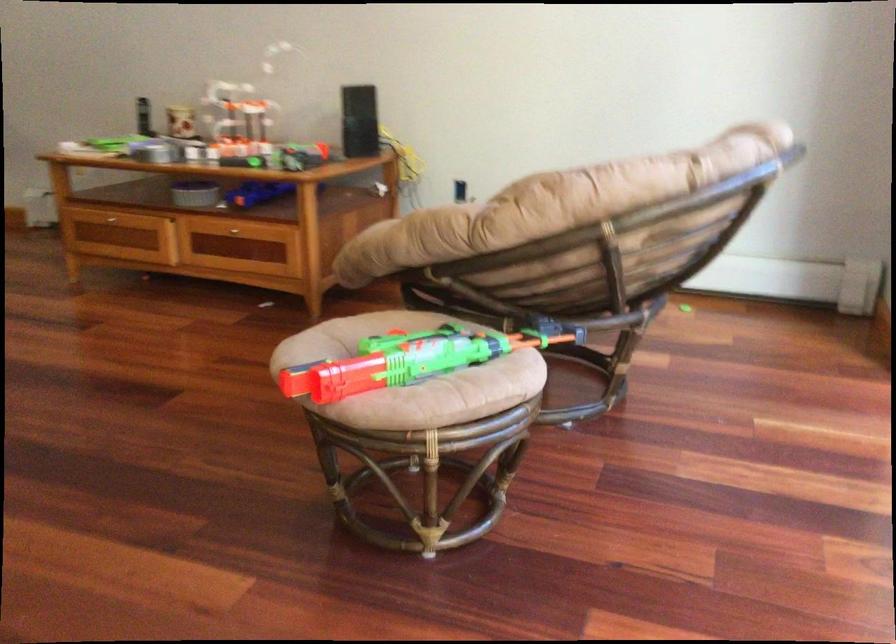
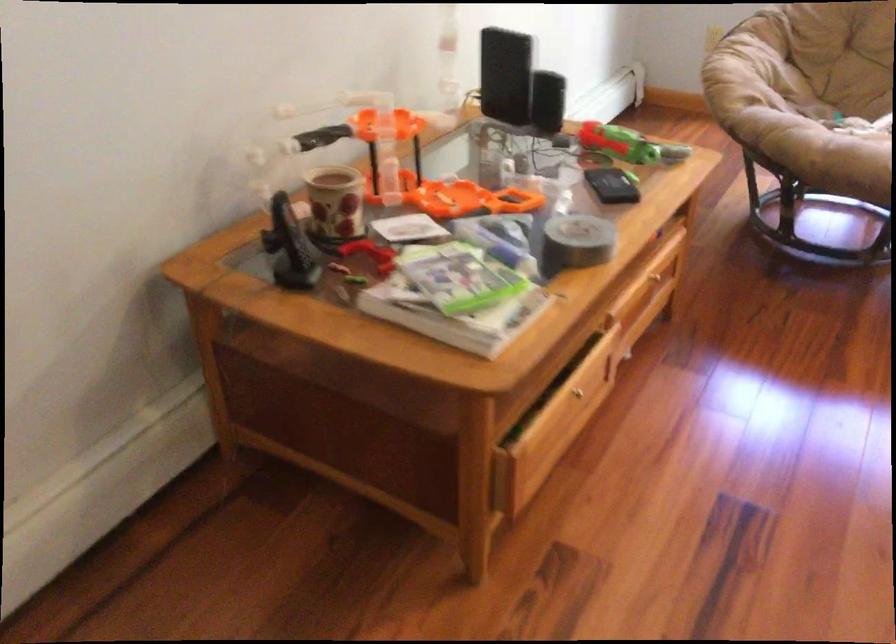
Where in the second image is the point corresponding to point 121,228 from the first image?

(578, 393)